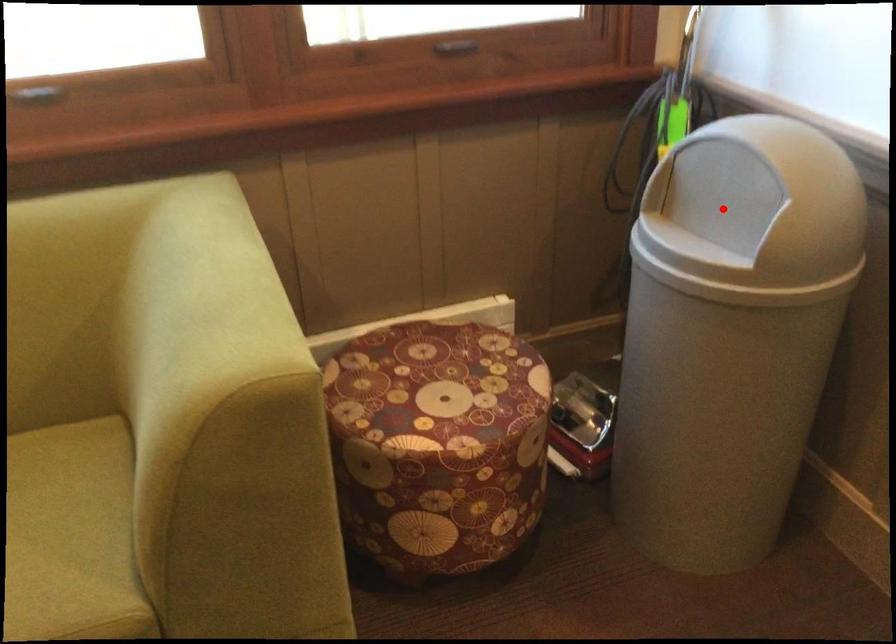
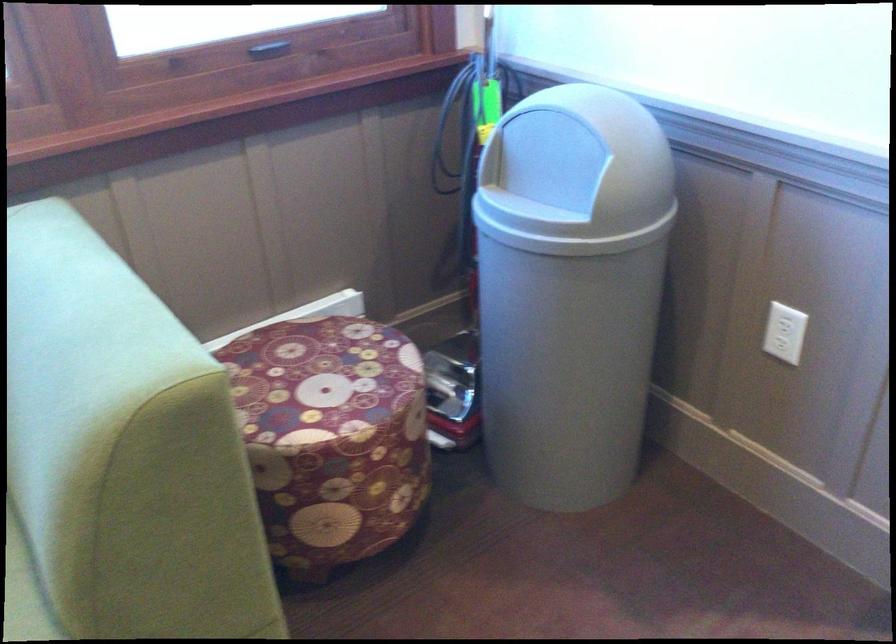
Question: A red point is marked in image1. In image2, is the corresponding 3D point closer to the camera or farther? Reply with the corresponding letter.

Choices:
 (A) The corresponding 3D point is closer.
 (B) The corresponding 3D point is farther.

Answer: (B)